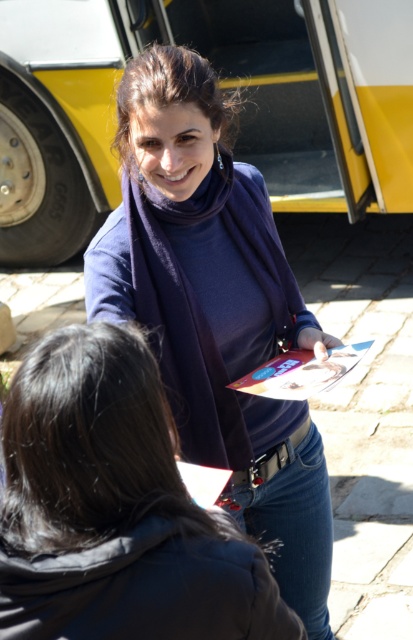
Is blue matte scarf at upper center further to the viewer compared to metallic silver belt at center?

No.

Who is shorter, blue matte scarf at upper center or metallic silver belt at center?

metallic silver belt at center is shorter.

Is point (31, 538) farther from viewer compared to point (261, 477)?

That is False.

The width and height of the screenshot is (413, 640). I want to click on blue matte scarf at upper center, so click(114, 509).

Can you confirm if matte purple scarf at center is wider than metallic silver belt at center?

Yes, matte purple scarf at center is wider than metallic silver belt at center.

Which is more to the right, matte purple scarf at center or metallic silver belt at center?

metallic silver belt at center

Between point (127, 307) and point (239, 483), which one is positioned in front?

Positioned in front is point (127, 307).

This screenshot has width=413, height=640. I want to click on matte purple scarf at center, so click(215, 307).

Is yellow matte bus at upper center above metallic silver belt at center?

Yes.

Looking at this image, measure the distance between yellow matte bus at upper center and metallic silver belt at center.

yellow matte bus at upper center and metallic silver belt at center are 13.39 feet apart from each other.

Does point (362, 10) lie in front of point (256, 480)?

No.

This screenshot has height=640, width=413. What are the coordinates of `yellow matte bus at upper center` in the screenshot? It's located at (220, 86).